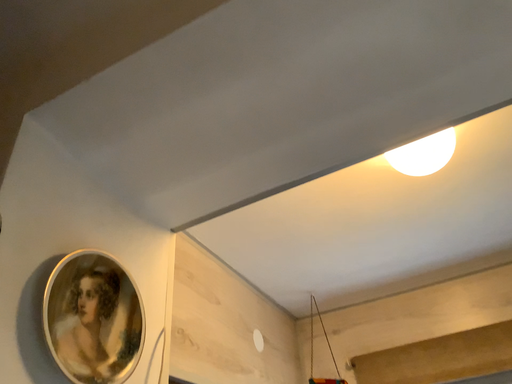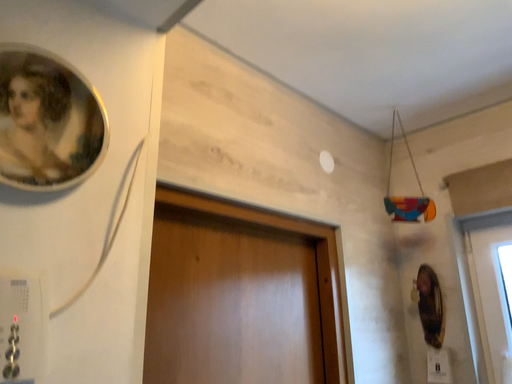
Question: How did the camera likely rotate when shooting the video?

Choices:
 (A) rotated upward
 (B) rotated downward

Answer: (B)